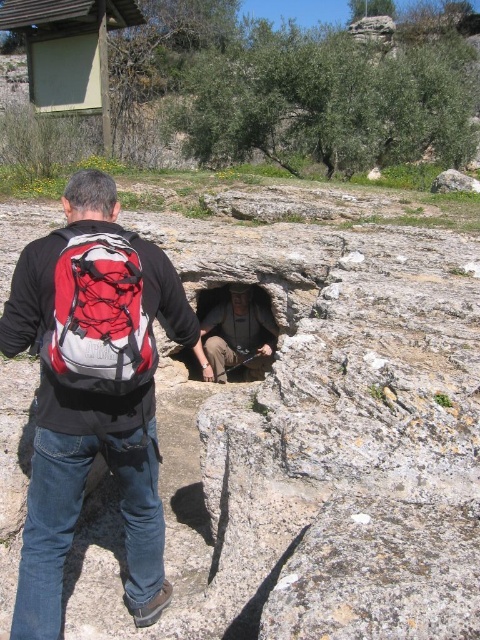
Question: Based on their relative distances, which object is nearer to the red mesh backpack at center?

Choices:
 (A) red backpack at center
 (B) smooth gray rock at center

Answer: (A)

Question: Observing the image, what is the correct spatial positioning of red mesh backpack at center in reference to smooth gray rock at center?

Choices:
 (A) left
 (B) right

Answer: (A)

Question: Which point appears farthest from the camera in this image?

Choices:
 (A) (112, 369)
 (B) (462, 176)
 (C) (212, 333)

Answer: (B)

Question: Is red mesh backpack at center smaller than smooth gray rock at center?

Choices:
 (A) no
 (B) yes

Answer: (B)

Question: Observing the image, what is the correct spatial positioning of red mesh backpack at center in reference to rough stone hole at center?

Choices:
 (A) right
 (B) left

Answer: (B)

Question: Which object is the farthest from the red mesh backpack at center?

Choices:
 (A) red backpack at center
 (B) rough stone hole at center

Answer: (B)